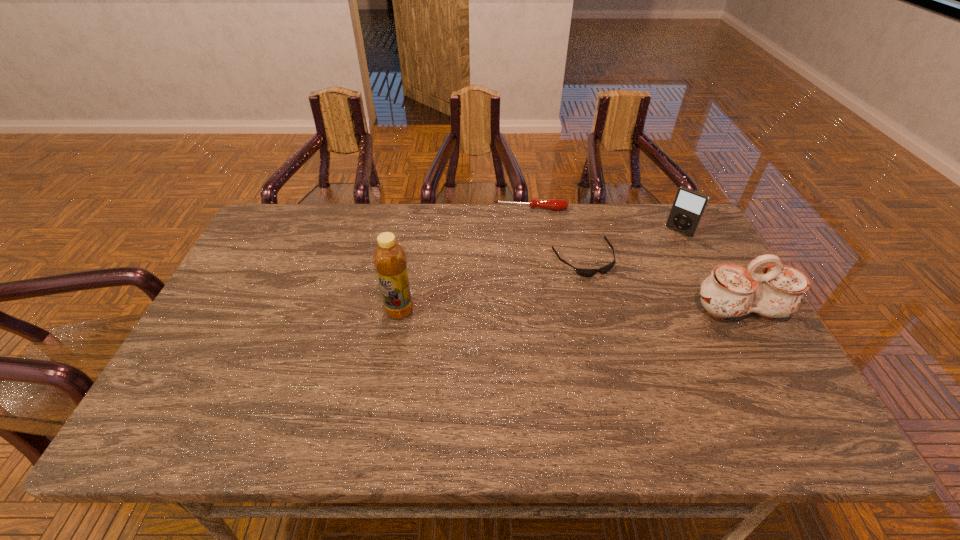
This screenshot has width=960, height=540. I want to click on bottle, so click(389, 257).

Identify the location of the leftmost object. Image resolution: width=960 pixels, height=540 pixels. (389, 257).

The width and height of the screenshot is (960, 540). I want to click on chinaware, so click(x=730, y=291).

Where is `screwdriver`? This screenshot has width=960, height=540. screwdriver is located at coordinates (552, 204).

The width and height of the screenshot is (960, 540). I want to click on the farthest object, so click(552, 204).

Image resolution: width=960 pixels, height=540 pixels. What are the coordinates of `the third nearest object` in the screenshot? It's located at (582, 272).

The image size is (960, 540). Identify the location of the shortest object. (582, 272).

Locate an element on the screen. iPod is located at coordinates (689, 205).

Locate an element on the screen. The width and height of the screenshot is (960, 540). the third tallest object is located at coordinates (689, 205).

Where is `free location located 0.400m on the right of the leftmost object`? free location located 0.400m on the right of the leftmost object is located at coordinates (564, 311).